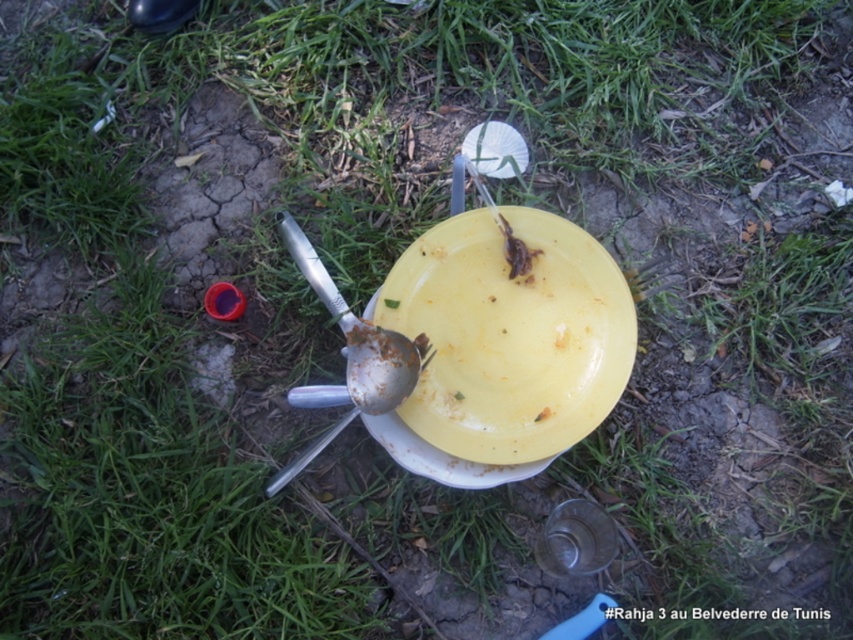
Between yellow matte plate at center and silver metallic spoon at center, which one is positioned lower?

Positioned lower is silver metallic spoon at center.

Which is in front, point (579, 380) or point (352, 388)?

Point (352, 388) is more forward.

Does point (494, 371) come closer to viewer compared to point (352, 381)?

No, (494, 371) is further to viewer.

This screenshot has width=853, height=640. What are the coordinates of `yellow matte plate at center` in the screenshot? It's located at (509, 336).